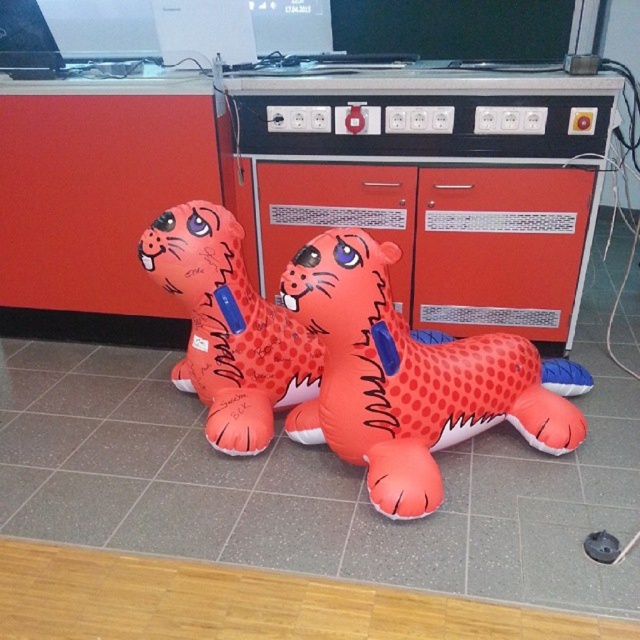
You are standing in a room with a rubber inflatable tiger at center. If you want to touch the tiger, how many steps do you need to take if each step covers 0.5 meters?

The rubber inflatable tiger at center is 1.92 meters away from viewer. Since each step covers 0.5 meters, you would need to take approximately 4 steps to reach it.